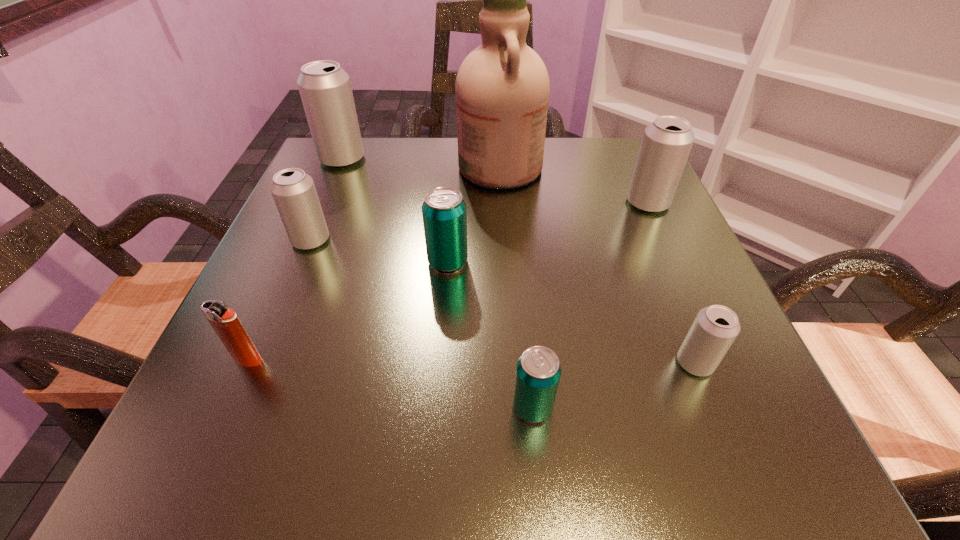
The image size is (960, 540). I want to click on vacant position located 0.050m on the front of the igniter, so click(x=230, y=400).

I want to click on free space located on the back of the smallest white beer can, so click(x=624, y=188).

The width and height of the screenshot is (960, 540). I want to click on free spot located 0.090m on the right of the fourth beer can from left to right, so (624, 407).

At what (x,y) coordinates should I click in order to perform the action: click on cleansing agent that is at the far edge. Please return your answer as a coordinate pair (x, y). Looking at the image, I should click on (502, 87).

Where is `object that is positioned at the near edge`? object that is positioned at the near edge is located at coordinates (538, 371).

In order to click on igniter that is positioned at the left edge in this screenshot , I will do `click(225, 322)`.

The image size is (960, 540). I want to click on object at the far left corner, so click(x=325, y=89).

Locate an element on the screen. object that is at the far right corner is located at coordinates (666, 143).

Identify the location of blank space at the far edge of the desktop. (458, 149).

In the image, there is a desktop. Identify the location of free region at the near edge. The image size is (960, 540). (466, 455).